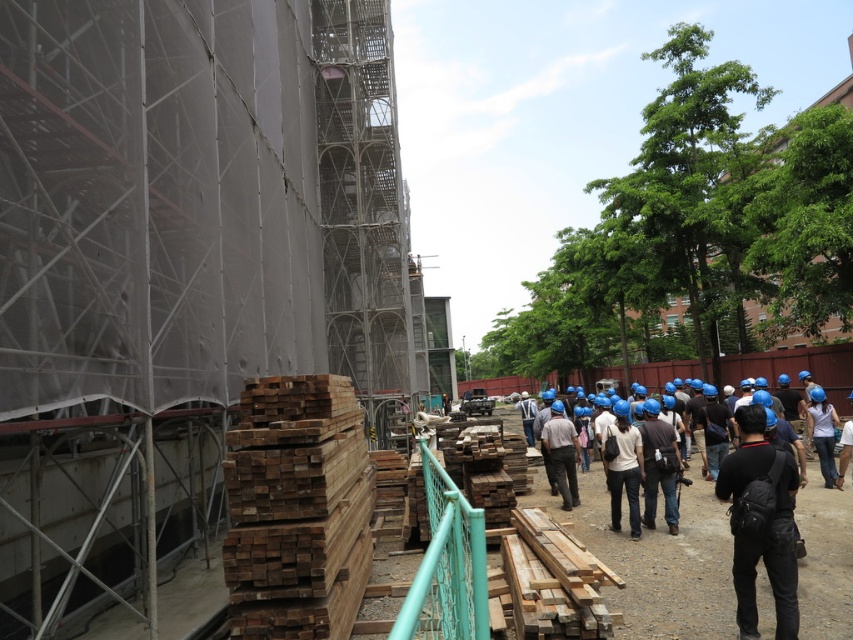
Question: Does weathered wood at lower left have a lesser width compared to dark gray fabric camera bag at center?

Choices:
 (A) yes
 (B) no

Answer: (B)

Question: Which point is farther to the camera?

Choices:
 (A) weathered wood at lower left
 (B) dark gray fabric camera bag at center

Answer: (A)

Question: Does weathered wood at lower left have a smaller size compared to dark gray fabric camera bag at center?

Choices:
 (A) no
 (B) yes

Answer: (A)

Question: Which of the following is the farthest from the observer?

Choices:
 (A) dark gray fabric camera bag at center
 (B) weathered wood at lower left

Answer: (B)

Question: Does weathered wood at lower left have a greater width compared to dark gray fabric camera bag at center?

Choices:
 (A) yes
 (B) no

Answer: (A)